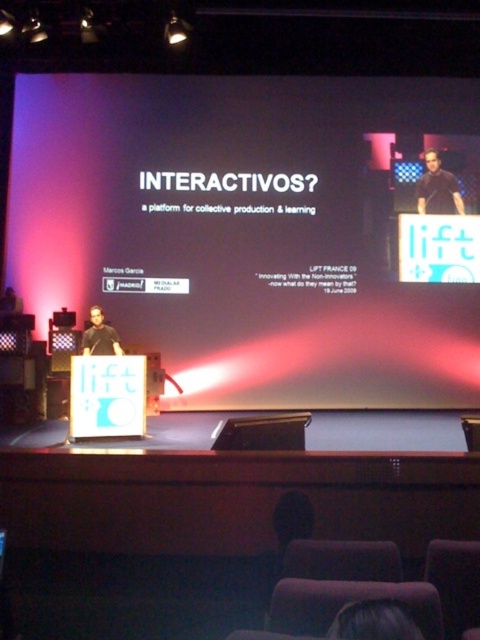
Does point (139, 333) come in front of point (368, 608)?

No, (139, 333) is further to viewer.

Is white matte projection screen at upper center bigger than dark brown hair at upper center?

Indeed, white matte projection screen at upper center has a larger size compared to dark brown hair at upper center.

Between point (127, 88) and point (334, 627), which one is positioned in front?

Point (334, 627)

Locate an element on the screen. This screenshot has height=640, width=480. white matte projection screen at upper center is located at coordinates pyautogui.click(x=241, y=232).

Consider the image. Can you confirm if black shirt at upper right is thinner than matte black shirt at center?

Incorrect, black shirt at upper right's width is not less than matte black shirt at center's.

Is black shirt at upper right to the left of matte black shirt at center from the viewer's perspective?

In fact, black shirt at upper right is to the right of matte black shirt at center.

Find the location of `black shirt at upper right`. black shirt at upper right is located at coordinates (437, 188).

Based on the photo, does white matte projection screen at upper center have a greater width compared to matte black shirt at center?

Correct, the width of white matte projection screen at upper center exceeds that of matte black shirt at center.

Who is taller, white matte projection screen at upper center or matte black shirt at center?

Standing taller between the two is white matte projection screen at upper center.

Locate an element on the screen. The height and width of the screenshot is (640, 480). white matte projection screen at upper center is located at coordinates (241, 232).

At what (x,y) coordinates should I click in order to perform the action: click on white matte projection screen at upper center. Please return your answer as a coordinate pair (x, y). This screenshot has height=640, width=480. Looking at the image, I should click on (241, 232).